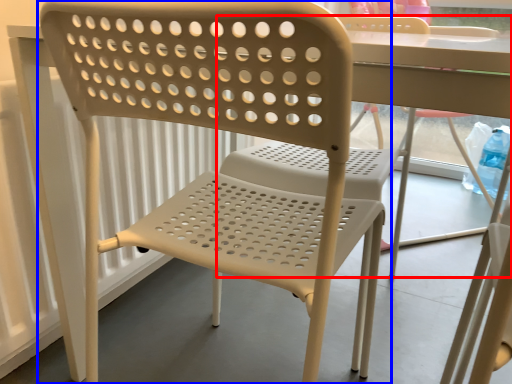
Question: Which object appears closest to the camera in this image, chair (highlighted by a red box) or chair (highlighted by a blue box)?

Choices:
 (A) chair
 (B) chair

Answer: (B)